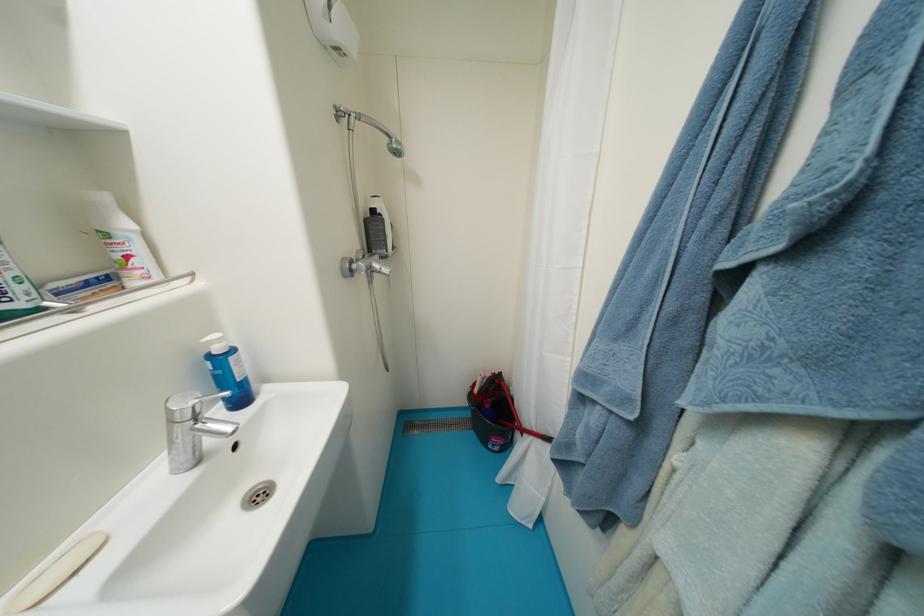
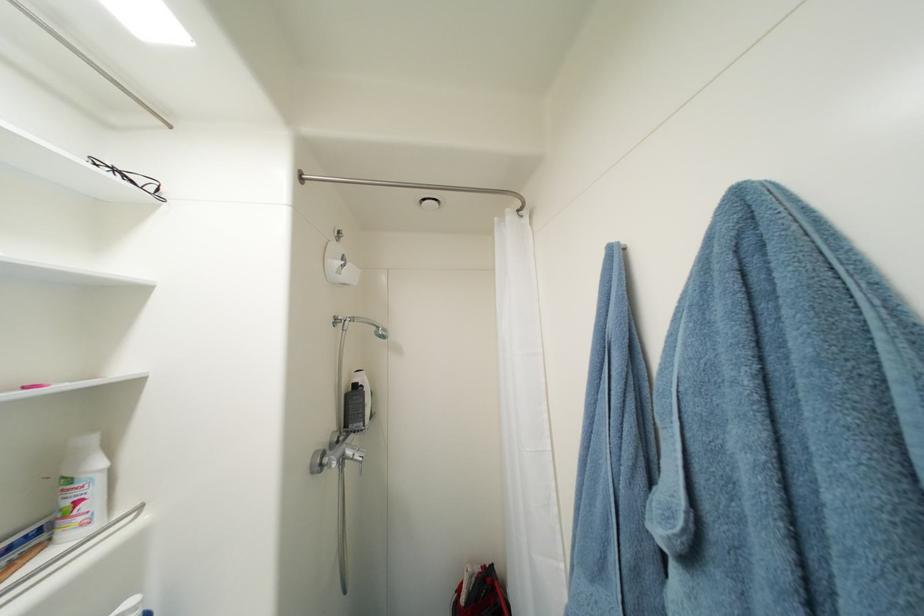
Where in the second image is the point corresponding to point 383,267 from the first image?

(356, 454)